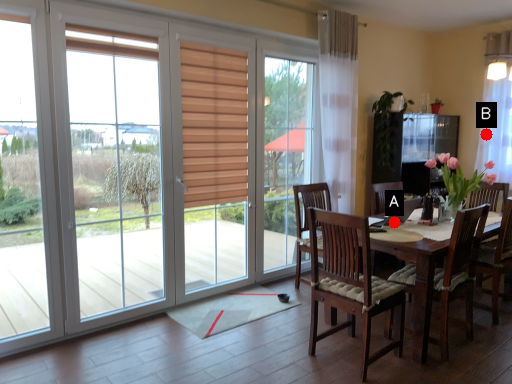
Question: Two points are circled on the image, labeled by A and B beside each circle. Which point appears closest to the camera in this image?

Choices:
 (A) A is closer
 (B) B is closer

Answer: (A)